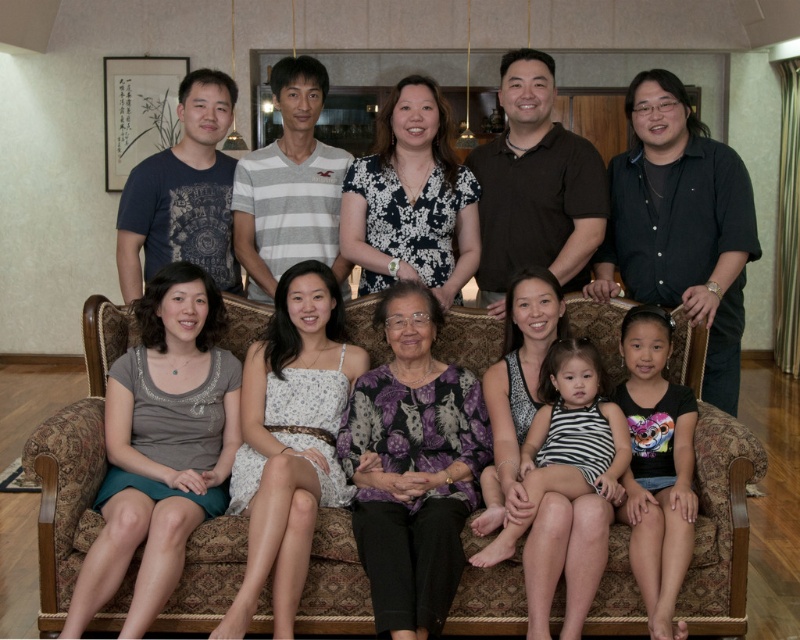
Question: Can you confirm if patterned fabric couch at center is bigger than white floral dress at center?

Choices:
 (A) no
 (B) yes

Answer: (B)

Question: Which point is farther to the camera?

Choices:
 (A) [x=486, y=342]
 (B) [x=289, y=593]

Answer: (A)

Question: Can you confirm if patterned fabric couch at center is positioned above white floral dress at center?

Choices:
 (A) no
 (B) yes

Answer: (A)

Question: Does patterned fabric couch at center have a lesser width compared to white floral dress at center?

Choices:
 (A) yes
 (B) no

Answer: (B)

Question: Among these objects, which one is nearest to the camera?

Choices:
 (A) white floral dress at center
 (B) patterned fabric couch at center

Answer: (A)